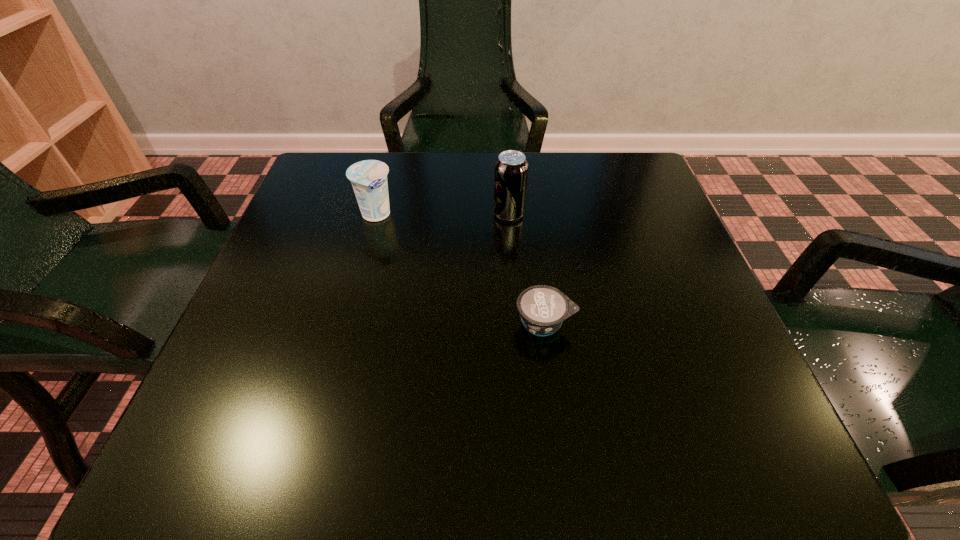
The width and height of the screenshot is (960, 540). In order to click on free space between the shortest object and the leftmost object in this screenshot , I will do `click(460, 269)`.

In order to click on vacant area that lies between the soda can and the leftmost object in this screenshot , I will do `click(443, 215)`.

Find the location of a particular element. free space between the second tallest object and the nearest object is located at coordinates (460, 269).

The height and width of the screenshot is (540, 960). Find the location of `free space between the nearer yogurt and the tallest object`. free space between the nearer yogurt and the tallest object is located at coordinates (527, 268).

Where is `unoccupied area between the soda can and the left yogurt`? unoccupied area between the soda can and the left yogurt is located at coordinates (443, 215).

Where is `free space between the second shortest object and the tallest object`? free space between the second shortest object and the tallest object is located at coordinates (443, 215).

You are a GUI agent. You are given a task and a screenshot of the screen. Output one action in this format:
    pyautogui.click(x=<x>, y=<y>)
    Task: Click on the vacant region between the tallest object and the taller yogurt
    The width and height of the screenshot is (960, 540).
    Given the screenshot: What is the action you would take?
    pyautogui.click(x=443, y=215)

This screenshot has height=540, width=960. What are the coordinates of `vacant space in between the right yogurt and the soda can` in the screenshot? It's located at (527, 268).

Point out which object is positioned as the second nearest to the nearer yogurt. Please provide its 2D coordinates. Your answer should be formatted as a tuple, i.e. [(x, y)], where the tuple contains the x and y coordinates of a point satisfying the conditions above.

[(368, 178)]

Select which object appears as the second closest to the tallest object. Please provide its 2D coordinates. Your answer should be formatted as a tuple, i.e. [(x, y)], where the tuple contains the x and y coordinates of a point satisfying the conditions above.

[(542, 308)]